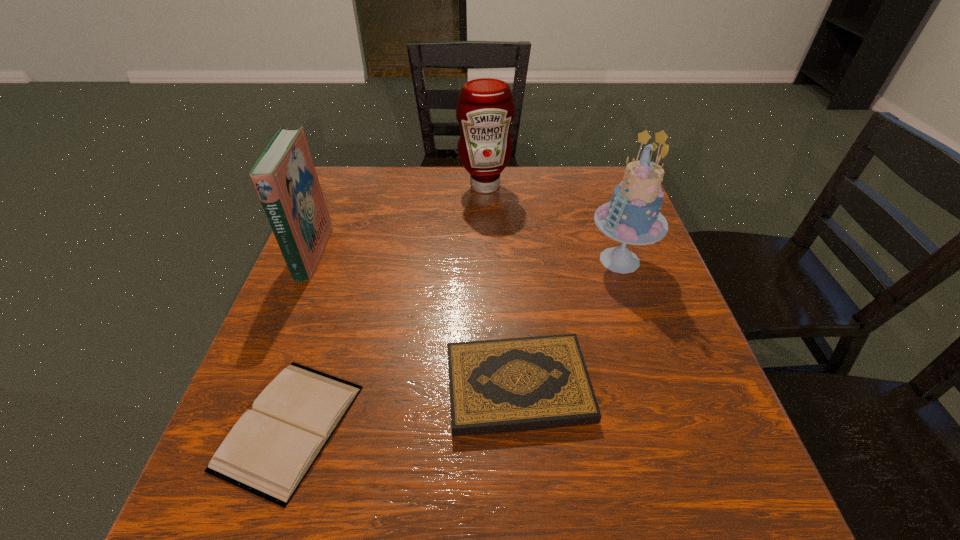
Identify which object is the third closest to the fourth tallest object. Please provide its 2D coordinates. Your answer should be formatted as a tuple, i.e. [(x, y)], where the tuple contains the x and y coordinates of a point satisfying the conditions above.

[(284, 176)]

Choose which object is the fourth nearest neighbor to the second shortest object. Please provide its 2D coordinates. Your answer should be formatted as a tuple, i.e. [(x, y)], where the tuple contains the x and y coordinates of a point satisfying the conditions above.

[(485, 109)]

Identify which hardback book is located as the nearest to the cake. Please provide its 2D coordinates. Your answer should be formatted as a tuple, i.e. [(x, y)], where the tuple contains the x and y coordinates of a point satisfying the conditions above.

[(518, 384)]

Where is `hardback book that stands as the closest to the second shortest hardback book`? The image size is (960, 540). hardback book that stands as the closest to the second shortest hardback book is located at coordinates (268, 452).

Image resolution: width=960 pixels, height=540 pixels. What are the coordinates of `vacant space that satisfies the following two spatial constraints: 1. on the back side of the rightmost hardback book; 2. on the right side of the shortest object` in the screenshot? It's located at (302, 387).

Find the location of a particular element. vacant space that satisfies the following two spatial constraints: 1. on the cover of the second tallest hardback book; 2. on the right side of the tallest hardback book is located at coordinates (257, 387).